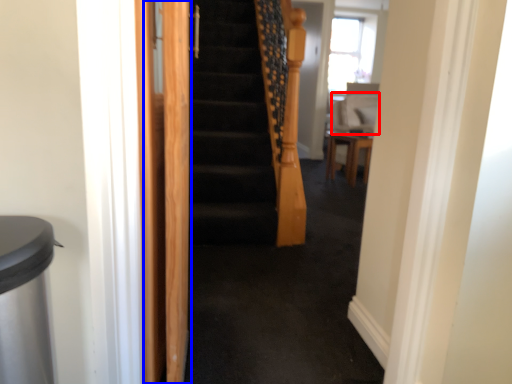
Question: Which object appears farthest to the camera in this image, sit (highlighted by a red box) or screen door (highlighted by a blue box)?

Choices:
 (A) sit
 (B) screen door

Answer: (A)